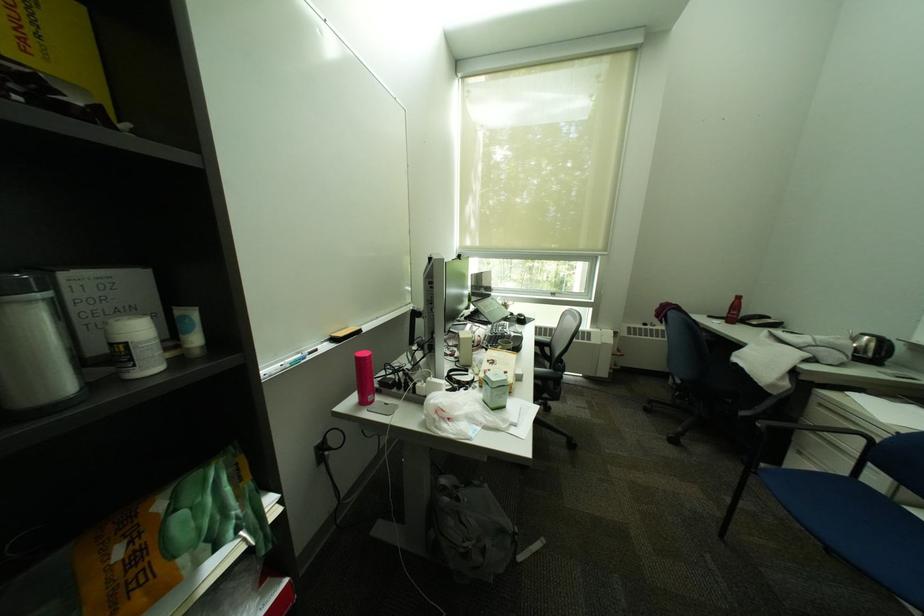
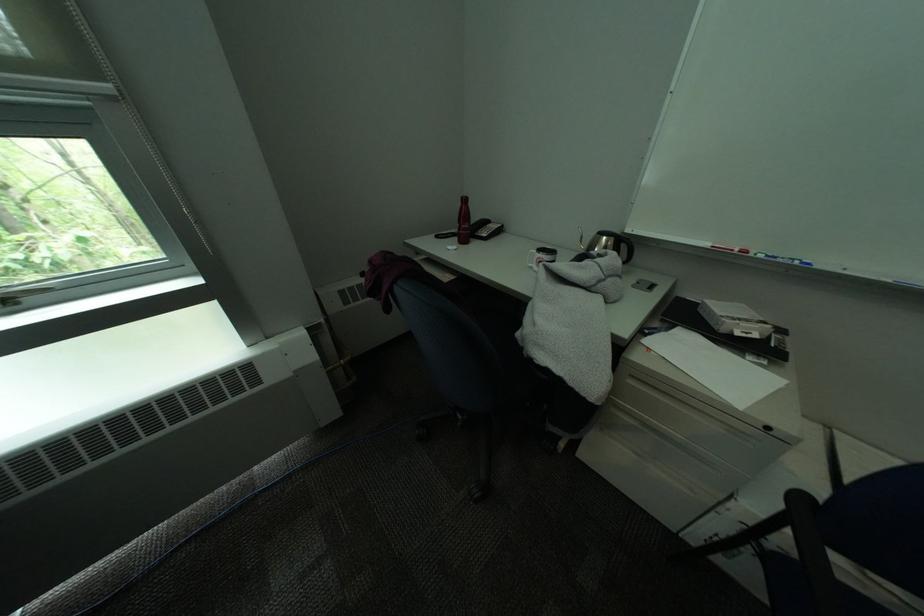
Locate, in the second image, the point that corresponds to point (617, 254) in the first image.

(119, 87)